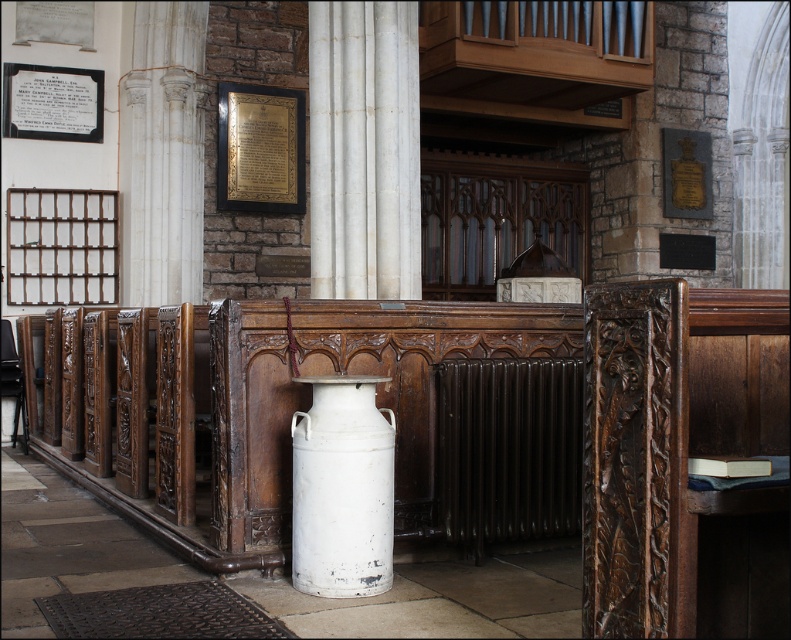
You are attending a ceremony in this historic church and notice two items at the center of the room. The dark brown radiator at center and the white matte milk canister at center. Which item is closer to you?

The dark brown radiator at center is closer to you than the white matte milk canister at center.

You are standing in the church and want to place a 15 feet long banner along the wall behind the dark brown radiator at center. Can you determine if the banner will fit?

The dark brown radiator at center is 17.06 feet from the viewer. Since the banner is 15 feet long, it will fit as the distance from the radiator to the wall is sufficient.